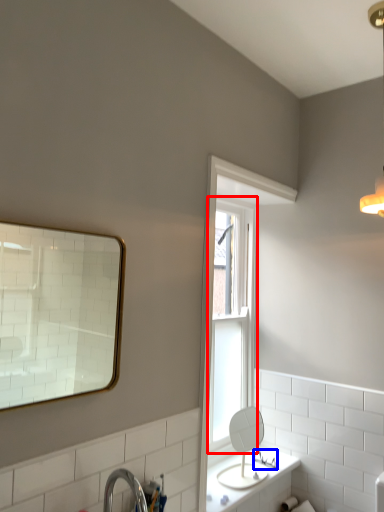
Question: Which object appears closest to the camera in this image, window (highlighted by a red box) or plumbing fixture (highlighted by a blue box)?

Choices:
 (A) window
 (B) plumbing fixture

Answer: (A)